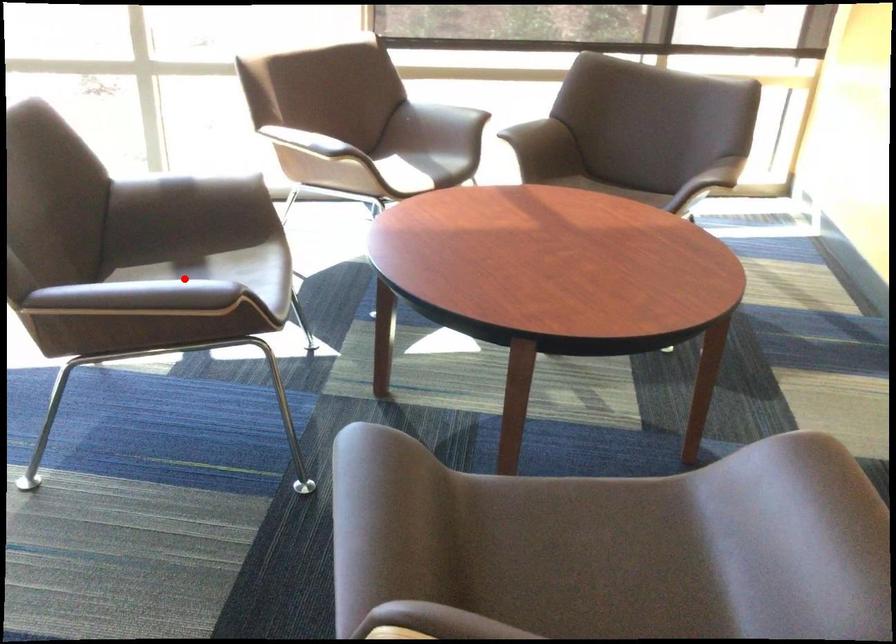
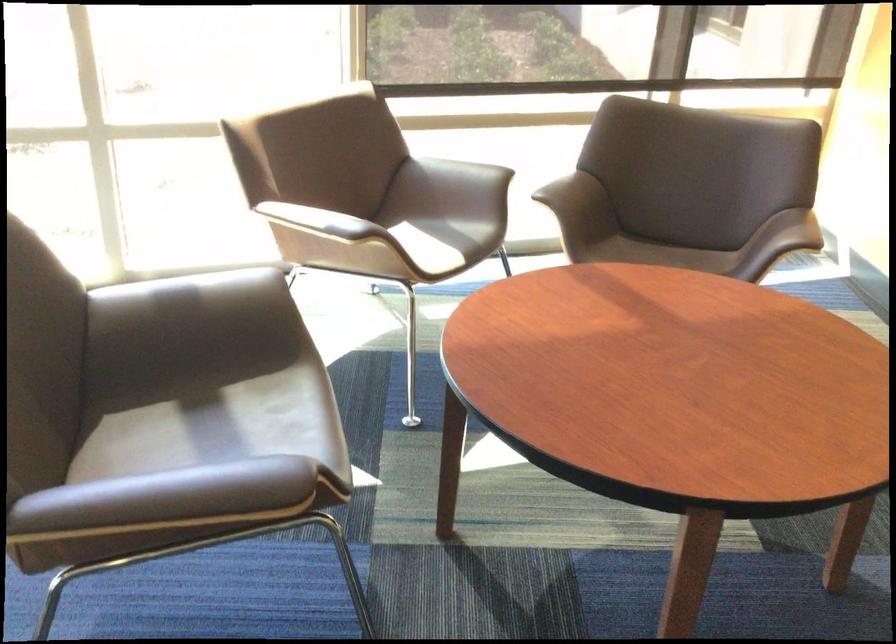
In the second image, find the point that corresponds to the highlighted location in the first image.

(197, 417)